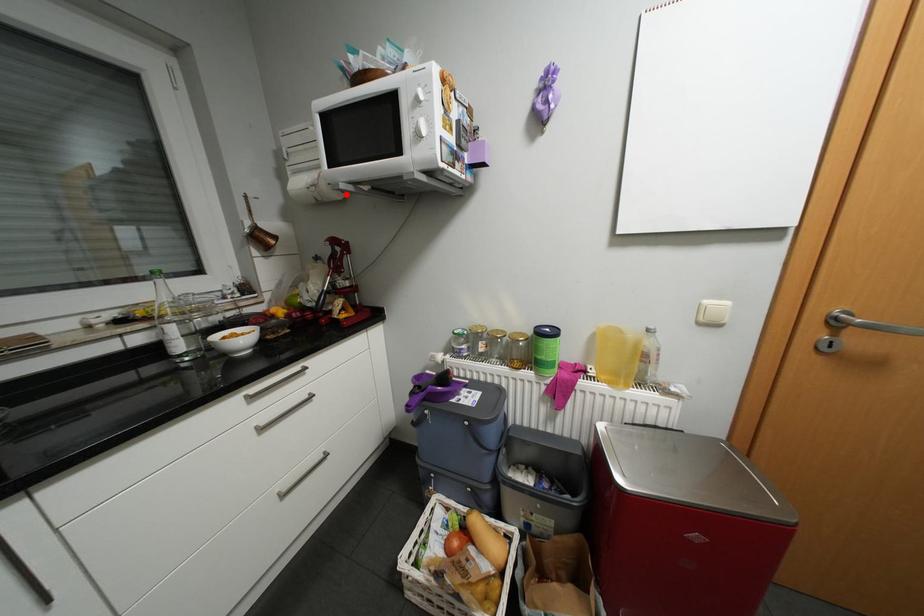
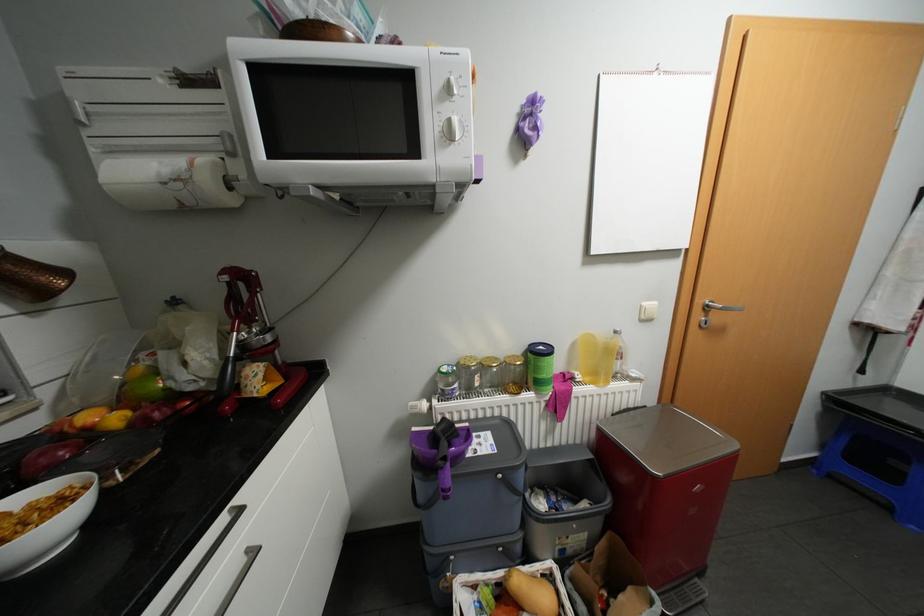
Question: I am providing you with two images of the same scene from different viewpoints. In image1, a red point is highlighted. Considering the same 3D point in image2, which of the following is correct?

Choices:
 (A) It is closer
 (B) It is farther

Answer: (B)